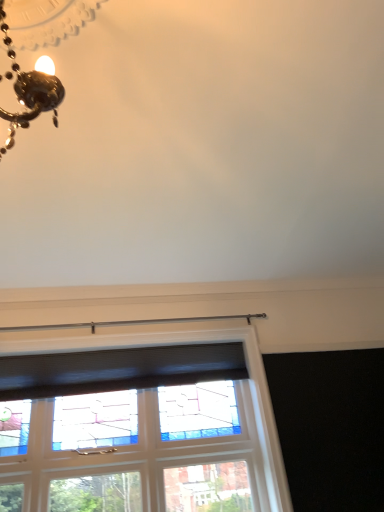
Find the location of a particular element. The image size is (384, 512). black mesh curtain at upper center is located at coordinates (118, 369).

Describe the element at coordinates (118, 369) in the screenshot. This screenshot has width=384, height=512. I see `black mesh curtain at upper center` at that location.

Consider the image. In order to face stained glass window at center, should I rotate leftwards or rightwards?

You should rotate left by 7.118 degrees.

Where is `stained glass window at center`? The image size is (384, 512). stained glass window at center is located at coordinates (157, 428).

This screenshot has width=384, height=512. What do you see at coordinates (157, 428) in the screenshot?
I see `stained glass window at center` at bounding box center [157, 428].

Image resolution: width=384 pixels, height=512 pixels. Find the location of `black mesh curtain at upper center`. black mesh curtain at upper center is located at coordinates (118, 369).

Between stained glass window at center and black mesh curtain at upper center, which one appears on the left side from the viewer's perspective?

black mesh curtain at upper center is more to the left.

Considering their positions, is stained glass window at center located in front of or behind black mesh curtain at upper center?

Visually, stained glass window at center is located in front of black mesh curtain at upper center.

Which is closer, (200, 456) or (130, 351)?

The point (200, 456) is in front.

From the image's perspective, is stained glass window at center on top of black mesh curtain at upper center?

No, from the image's perspective, stained glass window at center is not above black mesh curtain at upper center.

From a real-world perspective, which object stands above the other?

black mesh curtain at upper center.

Which of these two, stained glass window at center or black mesh curtain at upper center, is wider?

With larger width is stained glass window at center.

Which of these two, stained glass window at center or black mesh curtain at upper center, stands taller?

Standing taller between the two is stained glass window at center.

Is stained glass window at center bigger than black mesh curtain at upper center?

Yes, stained glass window at center is bigger than black mesh curtain at upper center.

Is black mesh curtain at upper center a part of stained glass window at center?

That's incorrect, black mesh curtain at upper center is not inside stained glass window at center.

Would you say stained glass window at center is a long distance from black mesh curtain at upper center?

No.

Is stained glass window at center oriented away from black mesh curtain at upper center?

Yes, black mesh curtain at upper center is at the back of stained glass window at center.

How many degrees apart are the facing directions of stained glass window at center and black mesh curtain at upper center?

The facing directions of stained glass window at center and black mesh curtain at upper center are 1.22 degrees apart.

At what (x,y) coordinates should I click in order to perform the action: click on window in front of the black mesh curtain at upper center. Please return your answer as a coordinate pair (x, y). This screenshot has height=512, width=384. Looking at the image, I should click on (157, 428).

Can you confirm if black mesh curtain at upper center is positioned to the right of stained glass window at center?

Incorrect, black mesh curtain at upper center is not on the right side of stained glass window at center.

Relative to stained glass window at center, is black mesh curtain at upper center in front or behind?

black mesh curtain at upper center is positioned farther from the viewer than stained glass window at center.

Considering the positions of points (90, 391) and (156, 508), is point (90, 391) closer to camera compared to point (156, 508)?

No.

From the image's perspective, is black mesh curtain at upper center beneath stained glass window at center?

No, from the image's perspective, black mesh curtain at upper center is not below stained glass window at center.

From a real-world perspective, is black mesh curtain at upper center beneath stained glass window at center?

No, from a real-world perspective, black mesh curtain at upper center is not beneath stained glass window at center.

Considering the relative sizes of black mesh curtain at upper center and stained glass window at center in the image provided, is black mesh curtain at upper center wider than stained glass window at center?

In fact, black mesh curtain at upper center might be narrower than stained glass window at center.

Who is taller, black mesh curtain at upper center or stained glass window at center?

With more height is stained glass window at center.

Considering the relative sizes of black mesh curtain at upper center and stained glass window at center in the image provided, is black mesh curtain at upper center bigger than stained glass window at center?

Incorrect, black mesh curtain at upper center is not larger than stained glass window at center.

Is black mesh curtain at upper center inside or outside of stained glass window at center?

A: black mesh curtain at upper center cannot be found inside stained glass window at center.

Would you consider black mesh curtain at upper center to be distant from stained glass window at center?

No, black mesh curtain at upper center is not far away from stained glass window at center.

Is black mesh curtain at upper center aimed at stained glass window at center?

Yes, black mesh curtain at upper center is aimed at stained glass window at center.

How distant is black mesh curtain at upper center from stained glass window at center?

Result: black mesh curtain at upper center and stained glass window at center are 9.73 inches apart from each other.

You are a GUI agent. You are given a task and a screenshot of the screen. Output one action in this format:
    pyautogui.click(x=<x>, y=<y>)
    Task: Click on the window below the black mesh curtain at upper center (from the image's perspective)
    The width and height of the screenshot is (384, 512).
    Given the screenshot: What is the action you would take?
    pyautogui.click(x=157, y=428)

Where is `curtain above the stained glass window at center (from a real-world perspective)`? The width and height of the screenshot is (384, 512). curtain above the stained glass window at center (from a real-world perspective) is located at coordinates (118, 369).

I want to click on curtain that is above the stained glass window at center (from the image's perspective), so click(x=118, y=369).